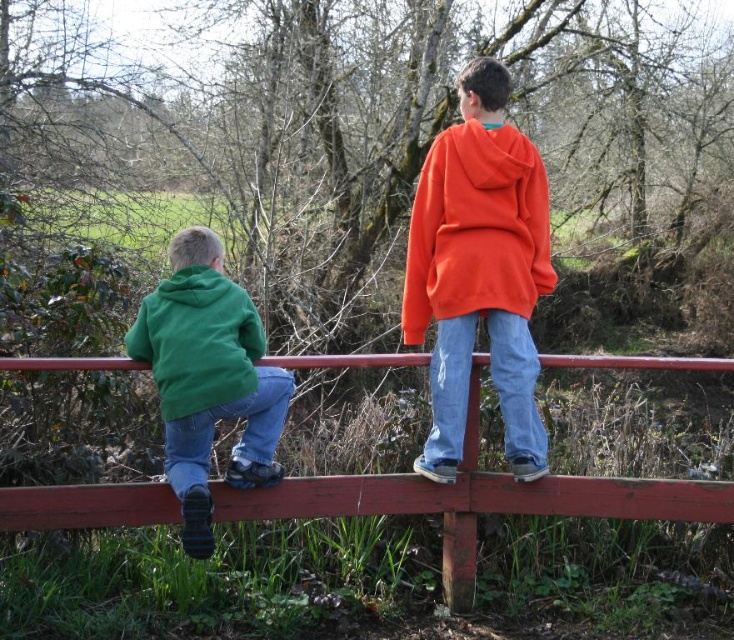
Question: Estimate the real-world distances between objects in this image. Which object is farther from the green matte hoodie at left?

Choices:
 (A) green fleece sweatshirt at left
 (B) smooth wooden fence at center
 (C) orange fleece jacket at upper center

Answer: (C)

Question: Which of the following is the farthest from the observer?

Choices:
 (A) green fleece sweatshirt at left
 (B) smooth wooden fence at center
 (C) orange fleece jacket at upper center
 (D) green matte hoodie at left

Answer: (B)

Question: Where is smooth wooden fence at center located in relation to green matte hoodie at left in the image?

Choices:
 (A) right
 (B) left

Answer: (A)

Question: Is smooth wooden fence at center bigger than green fleece sweatshirt at left?

Choices:
 (A) yes
 (B) no

Answer: (A)

Question: Which object is the closest to the orange fleece jacket at upper center?

Choices:
 (A) green fleece sweatshirt at left
 (B) smooth wooden fence at center

Answer: (B)

Question: Can you confirm if orange fleece jacket at upper center is positioned to the right of green fleece sweatshirt at left?

Choices:
 (A) no
 (B) yes

Answer: (B)